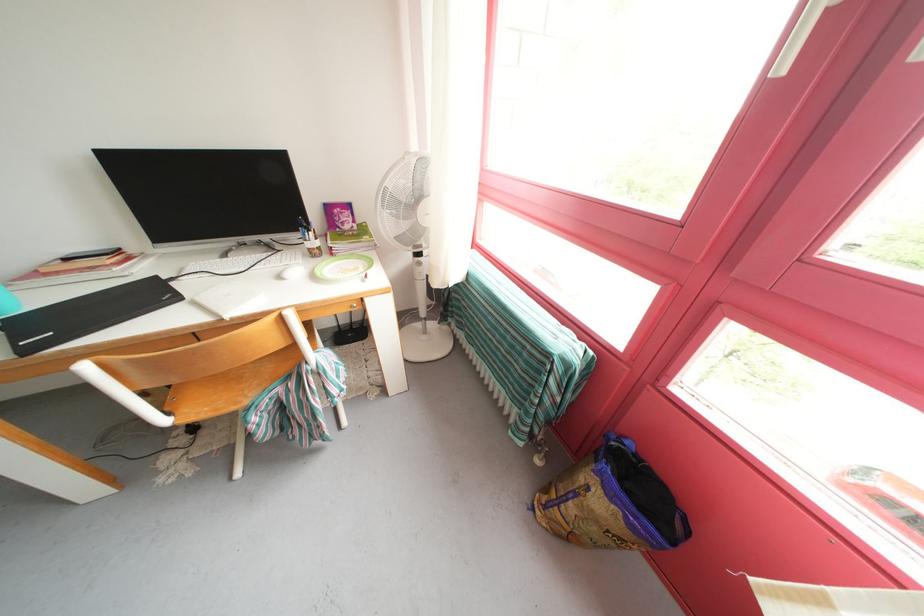
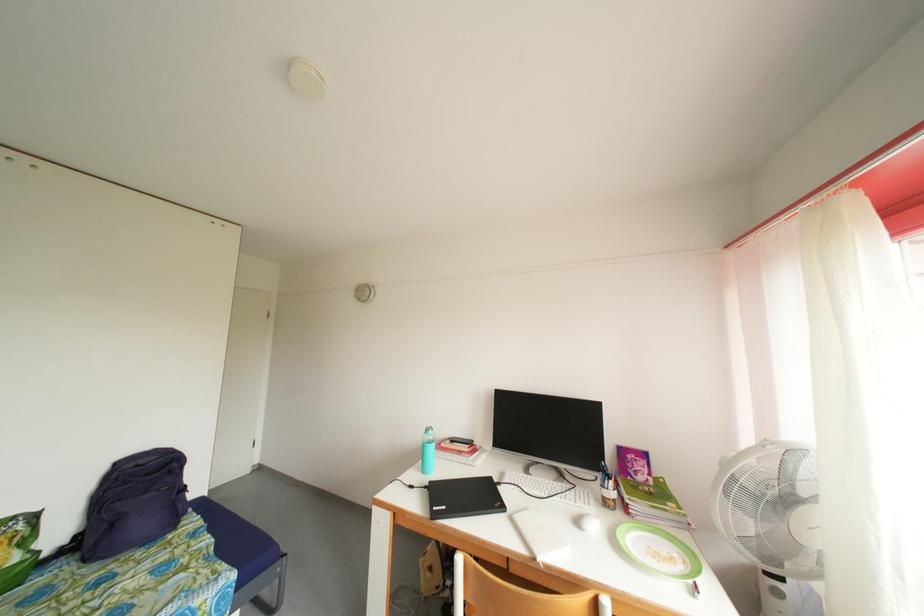
Where in the second image is the point corresponding to (x=286, y=282) from the first image?

(585, 528)